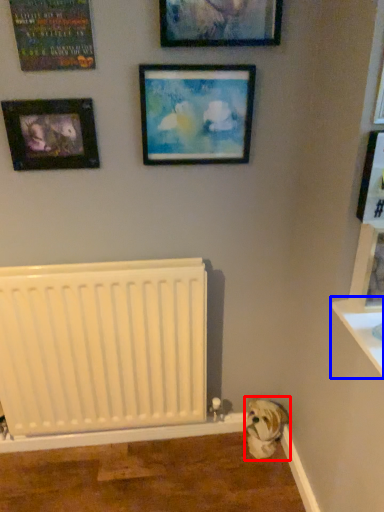
Question: Which object appears farthest to the camera in this image, animal (highlighted by a red box) or window sill (highlighted by a blue box)?

Choices:
 (A) animal
 (B) window sill

Answer: (A)